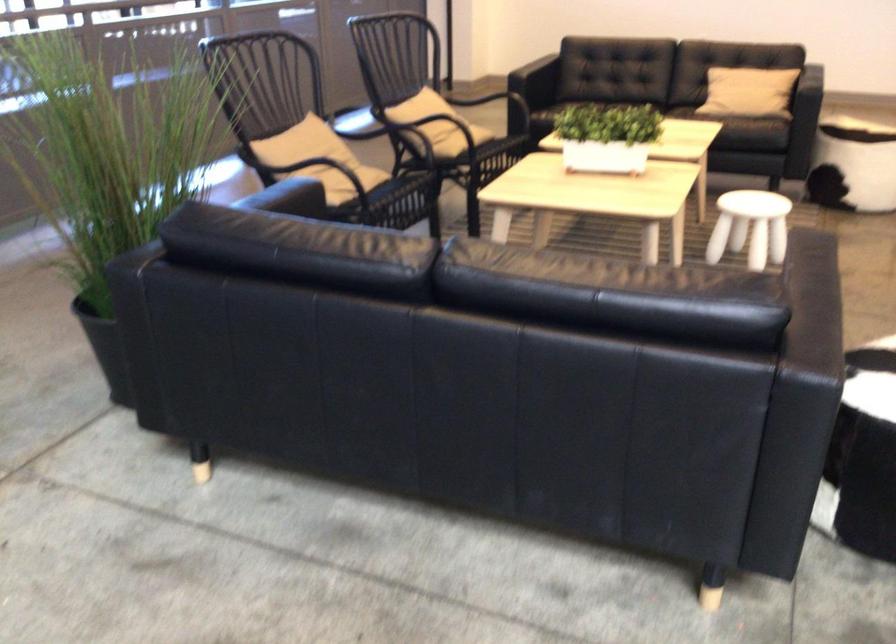
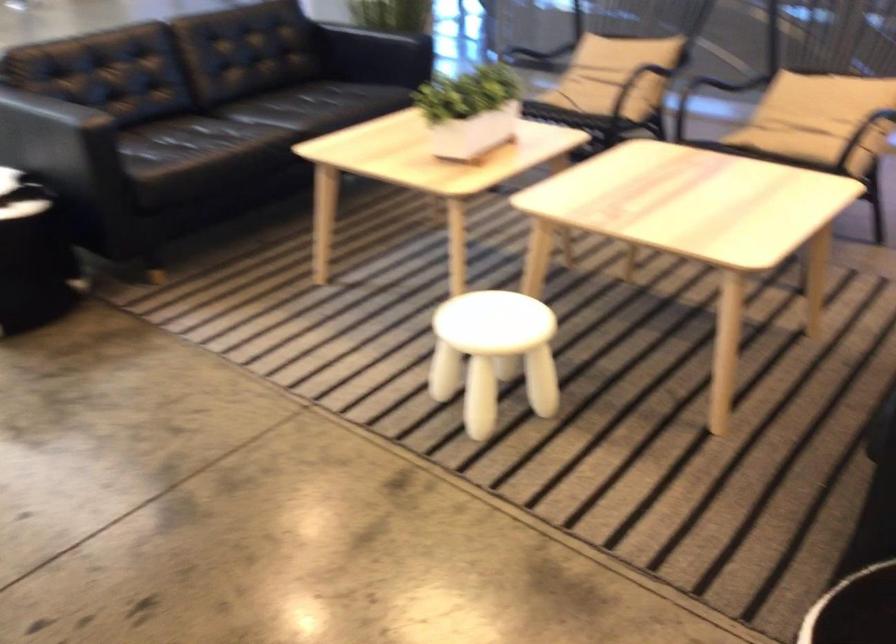
Question: I am providing you with two images of the same scene from different viewpoints. Which of the following objects are not visible in image2?

Choices:
 (A) sofa armrest
 (B) white stool
 (C) chalkboard bottom rail
 (D) beige chair sitting surface

Answer: (D)